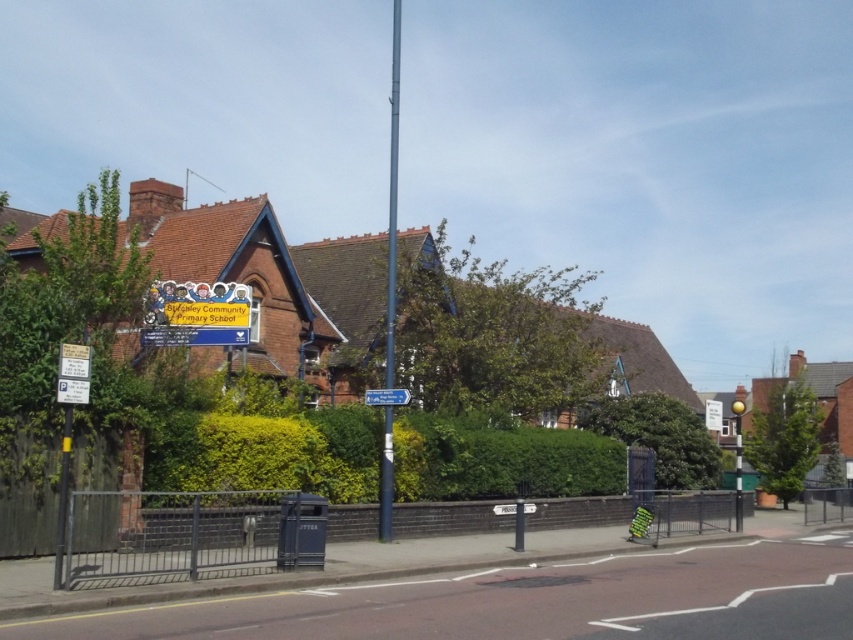
Is point (654, 404) more distant than point (527, 509)?

Yes.

Can you confirm if green leafy hedge at center is positioned below white plastic parking sign at center?

Actually, green leafy hedge at center is above white plastic parking sign at center.

Which is in front, point (606, 416) or point (492, 506)?

Point (492, 506)

The image size is (853, 640). Identify the location of green leafy hedge at center. (659, 436).

Does smooth asphalt road at lower center have a lesser height compared to white plastic parking sign at center?

Incorrect, smooth asphalt road at lower center's height does not fall short of white plastic parking sign at center's.

Which is below, smooth asphalt road at lower center or white plastic parking sign at center?

Positioned lower is white plastic parking sign at center.

Looking at this image, who is more distant from viewer, (254, 618) or (502, 506)?

The point (502, 506) is more distant.

Find the location of `smooth asphalt road at lower center`. smooth asphalt road at lower center is located at coordinates (529, 602).

Is point (393, 97) positioned behind point (399, 403)?

Yes, point (393, 97) is farther from viewer.

Is smooth metallic pole at center above blue plastic signpost at upper center?

Yes.

Is point (393, 294) closer to camera compared to point (373, 392)?

That is False.

The width and height of the screenshot is (853, 640). I want to click on smooth metallic pole at center, so click(x=392, y=196).